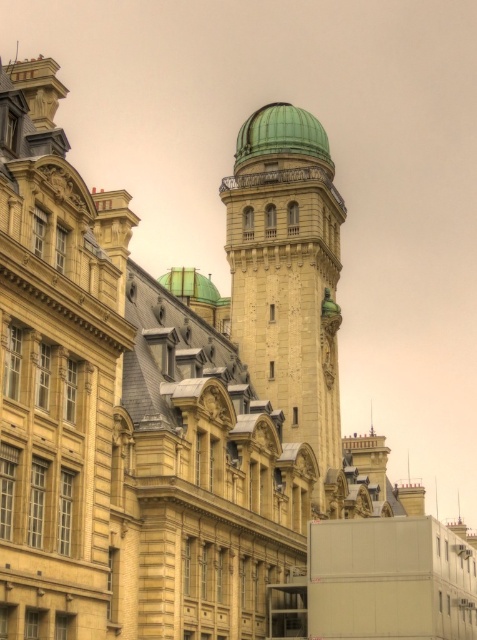
Question: Which point is closer to the camera?

Choices:
 (A) (251, 141)
 (B) (294, 173)
 (C) (175, 289)

Answer: (B)

Question: Is green dome at center to the right of green matte dome at upper center from the viewer's perspective?

Choices:
 (A) no
 (B) yes

Answer: (B)

Question: Which point is closer to the camera taking this photo?

Choices:
 (A) (303, 144)
 (B) (178, 296)
 (C) (279, 177)

Answer: (C)

Question: Is green dome at center wider than green polished dome at upper center?

Choices:
 (A) yes
 (B) no

Answer: (A)

Question: Where is green dome at center located in relation to green matte dome at upper center in the image?

Choices:
 (A) below
 (B) above

Answer: (A)

Question: Among these points, which one is farthest from the camera?

Choices:
 (A) (209, 291)
 (B) (265, 301)
 (C) (269, 112)

Answer: (A)